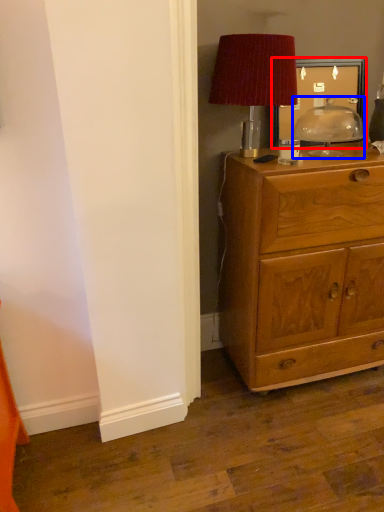
Question: Which point is closer to the camera, picture frame (highlighted by a red box) or table lamp (highlighted by a blue box)?

Choices:
 (A) picture frame
 (B) table lamp

Answer: (B)